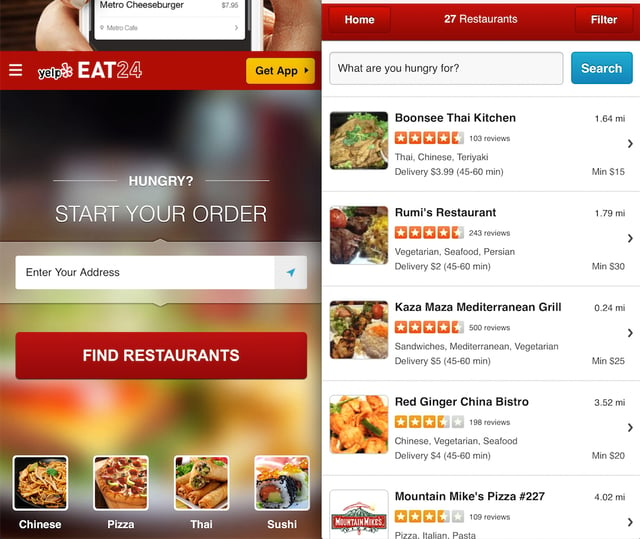
Identify the location of phone. (262, 20), (189, 40).